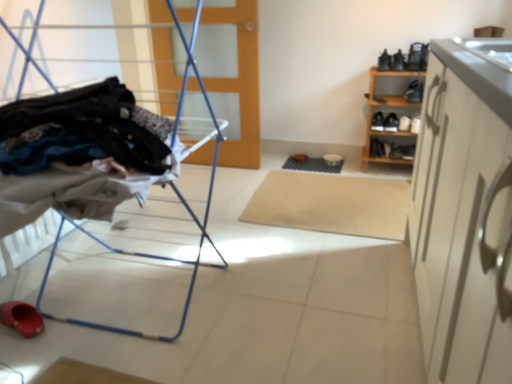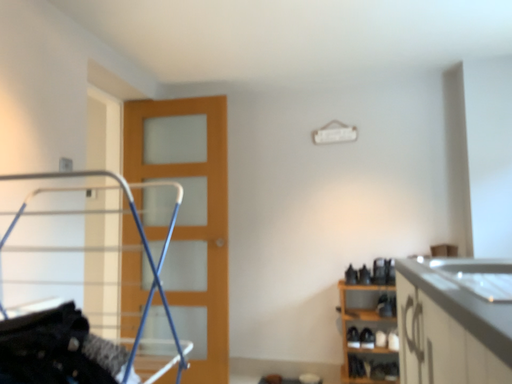
Question: How did the camera likely rotate when shooting the video?

Choices:
 (A) rotated downward
 (B) rotated upward

Answer: (B)